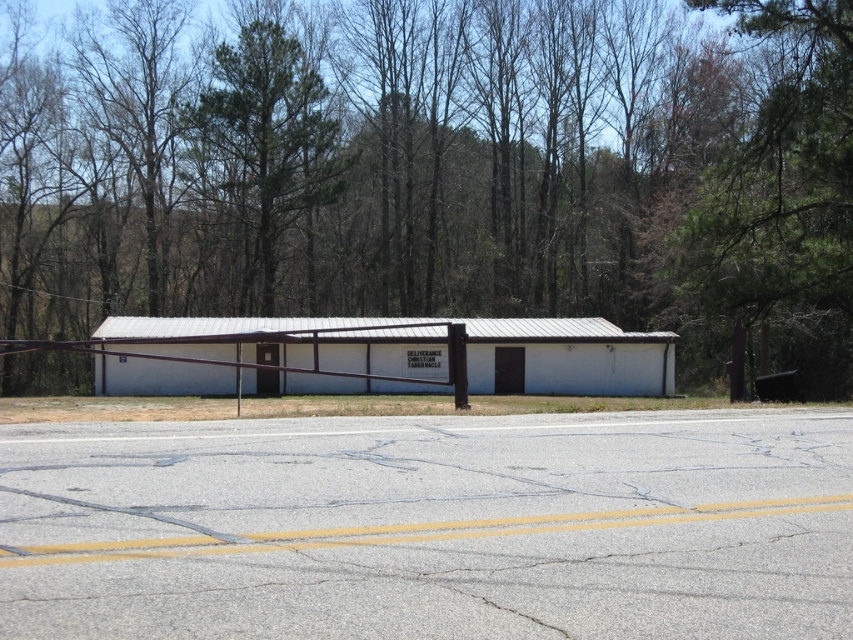
Question: Does green leafy tree at center have a lesser width compared to green leafy tree at upper center?

Choices:
 (A) no
 (B) yes

Answer: (A)

Question: Which point is closer to the camera?

Choices:
 (A) green leafy tree at center
 (B) green leafy tree at upper center

Answer: (A)

Question: Is green leafy tree at center below green leafy tree at upper center?

Choices:
 (A) no
 (B) yes

Answer: (B)

Question: Among these points, which one is nearest to the camera?

Choices:
 (A) (692, 45)
 (B) (223, 148)

Answer: (B)

Question: Observing the image, what is the correct spatial positioning of green leafy tree at center in reference to green leafy tree at upper center?

Choices:
 (A) left
 (B) right

Answer: (B)